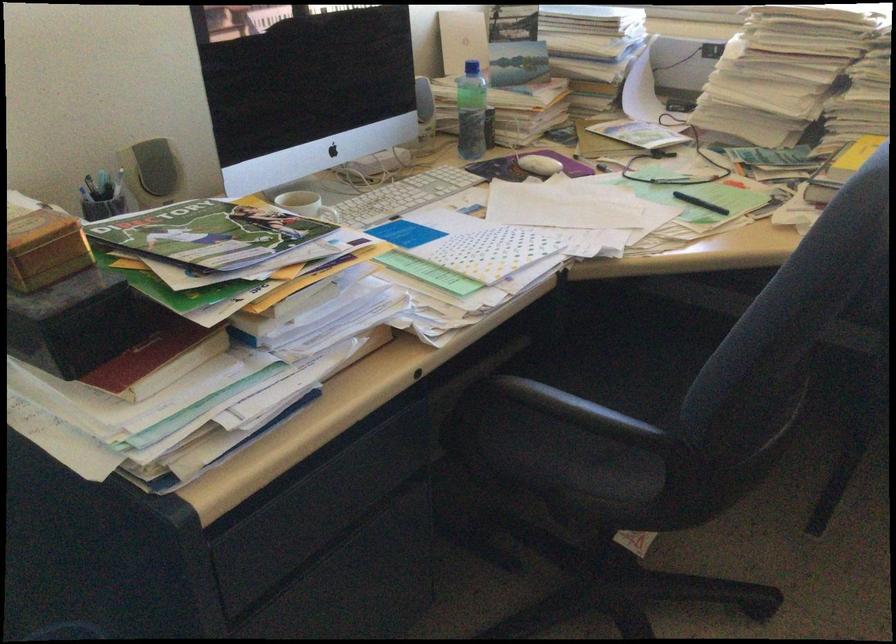
Where is `white cup handle`? Image resolution: width=896 pixels, height=644 pixels. white cup handle is located at coordinates (334, 216).